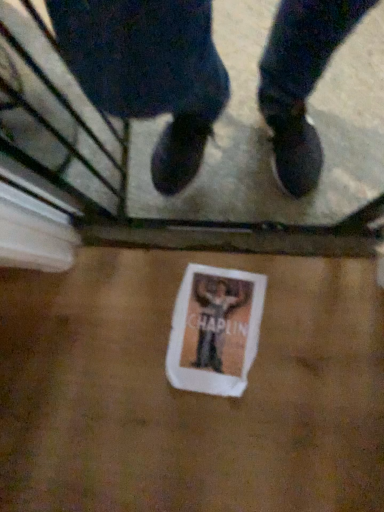
Identify the location of empty space that is ontop of white paper flyer at center (from a real-world perspective). The height and width of the screenshot is (512, 384). (213, 333).